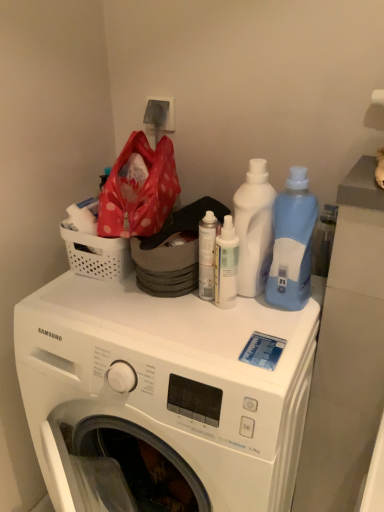
Question: Should I look upward or downward to see white perforated basket at upper left?

Choices:
 (A) up
 (B) down

Answer: (A)

Question: Is blue translucent bottle at right, which is the 1th cleaning product in right-to-left order, positioned before white glossy spray can at center, arranged as the 3th cleaning product when viewed from the right?

Choices:
 (A) yes
 (B) no

Answer: (A)

Question: Is blue translucent bottle at right, acting as the 3th cleaning product starting from the left, not inside white glossy spray can at center, arranged as the first cleaning product when viewed from the left?

Choices:
 (A) yes
 (B) no

Answer: (A)

Question: Is blue translucent bottle at right, acting as the 3th cleaning product starting from the left, positioned behind white glossy spray can at center, arranged as the first cleaning product when viewed from the left?

Choices:
 (A) no
 (B) yes

Answer: (A)

Question: Would you say white glossy spray can at center, arranged as the first cleaning product when viewed from the left, is part of blue translucent bottle at right, which is the 1th cleaning product in right-to-left order,'s contents?

Choices:
 (A) no
 (B) yes

Answer: (A)

Question: Is blue translucent bottle at right, which is the 1th cleaning product in right-to-left order, facing away from white glossy spray can at center, arranged as the first cleaning product when viewed from the left?

Choices:
 (A) yes
 (B) no

Answer: (B)

Question: From the image's perspective, is blue translucent bottle at right, which is the 1th cleaning product in right-to-left order, over white glossy spray can at center, arranged as the 3th cleaning product when viewed from the right?

Choices:
 (A) no
 (B) yes

Answer: (B)

Question: Would you say white perforated basket at upper left is outside white matte spray can at center?

Choices:
 (A) yes
 (B) no

Answer: (A)

Question: Could you tell me if white perforated basket at upper left is facing white matte spray can at center?

Choices:
 (A) yes
 (B) no

Answer: (B)

Question: Does white perforated basket at upper left appear on the left side of white matte spray can at center?

Choices:
 (A) yes
 (B) no

Answer: (A)

Question: Is white perforated basket at upper left positioned behind white matte spray can at center?

Choices:
 (A) yes
 (B) no

Answer: (A)

Question: Is white perforated basket at upper left at the right side of white matte spray can at center?

Choices:
 (A) yes
 (B) no

Answer: (B)

Question: Can you confirm if white perforated basket at upper left is bigger than white matte spray can at center?

Choices:
 (A) no
 (B) yes

Answer: (B)

Question: Is white perforated basket at upper left at the back of white glossy spray can at center, arranged as the first cleaning product when viewed from the left?

Choices:
 (A) no
 (B) yes

Answer: (A)